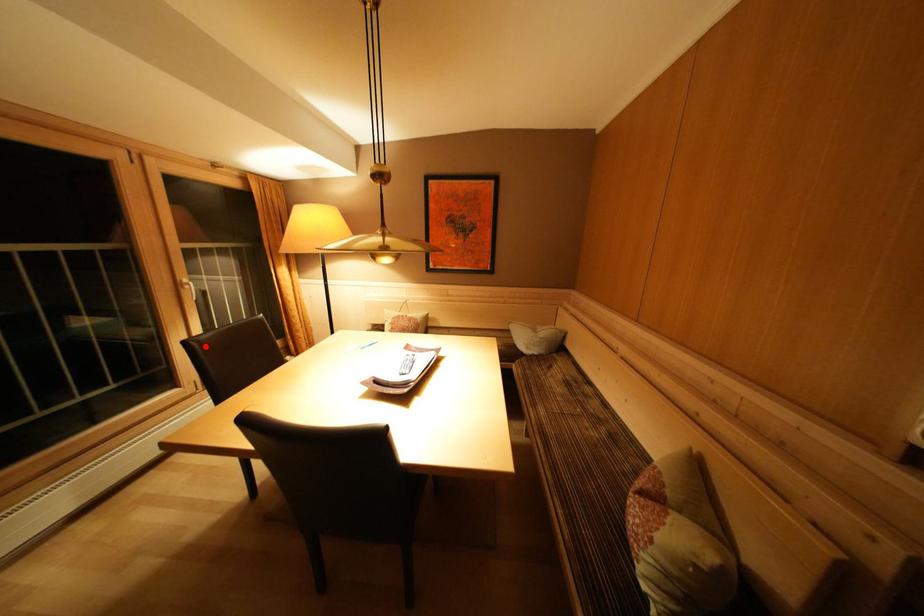
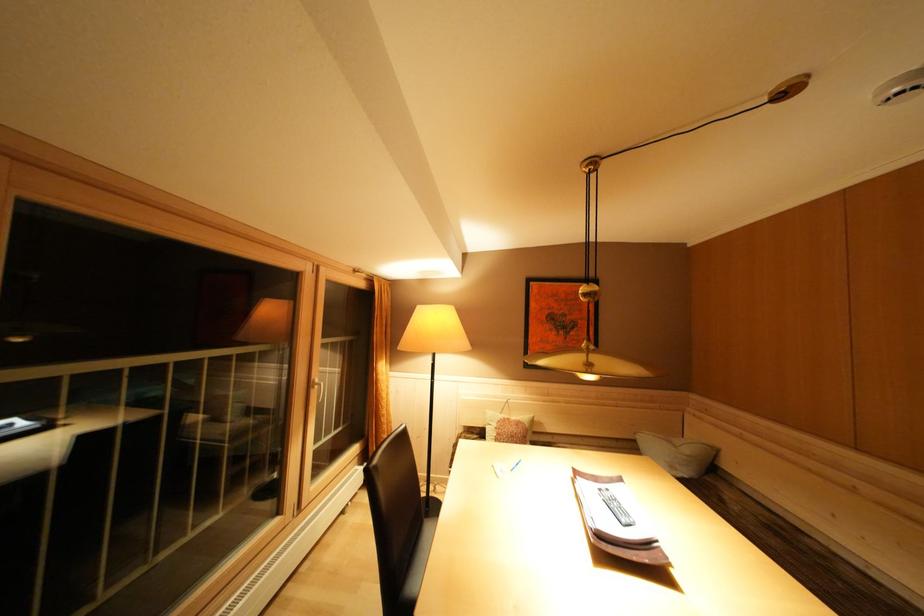
Find the pixel in the second image that matches the highlighted location in the first image.

(383, 472)